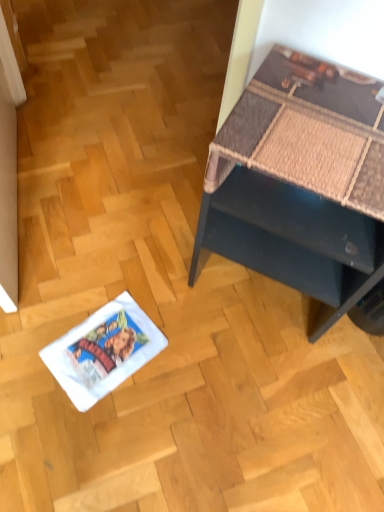
Locate an element on the screen. The width and height of the screenshot is (384, 512). space that is in front of white paper comic book at lower left is located at coordinates (82, 426).